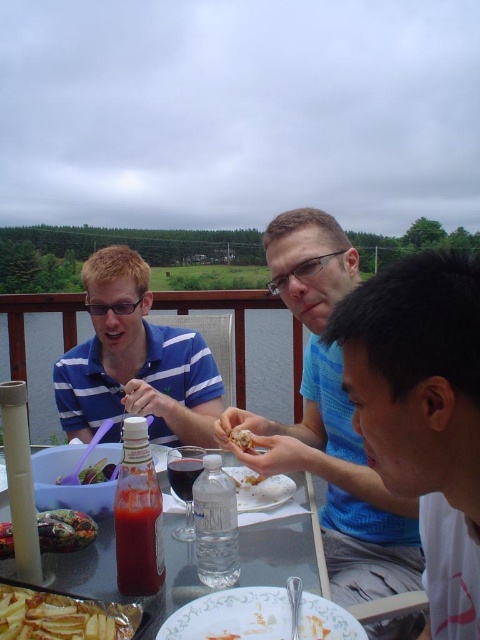
Question: Which point is closer to the camera?

Choices:
 (A) shiny plastic salad bowl at lower left
 (B) golden crispy chicken at center

Answer: (A)

Question: Does black matte hair at center appear on the right side of blue striped shirt at center?

Choices:
 (A) yes
 (B) no

Answer: (A)

Question: Which point appears closest to the camera in this image?

Choices:
 (A) (443, 476)
 (B) (331, 355)
 (C) (188, 337)

Answer: (A)

Question: Which point is farther from the camera taking this photo?

Choices:
 (A) (80, 625)
 (B) (84, 472)

Answer: (B)

Question: Is shiny plastic salad bowl at lower left positioned behind golden crispy chicken at center?

Choices:
 (A) yes
 (B) no

Answer: (B)

Question: Can you confirm if white porcelain plate at lower center is positioned above golden crispy fries at lower left?

Choices:
 (A) yes
 (B) no

Answer: (B)